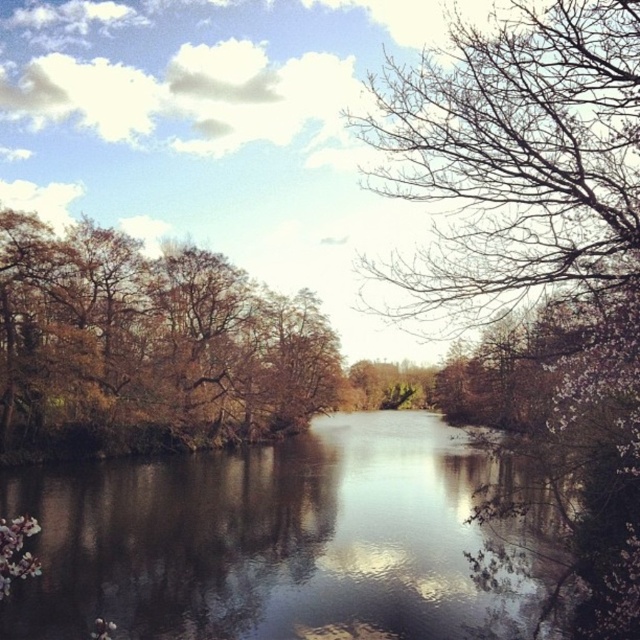
Is bare branches at upper right positioned behind brown leafy trees at left?

No, it is in front of brown leafy trees at left.

Is point (394, 136) more distant than point (170, 296)?

No, (394, 136) is closer to viewer.

Who is more forward, (528,152) or (116,358)?

Point (528,152)

Where is `bare branches at upper right`? This screenshot has width=640, height=640. bare branches at upper right is located at coordinates (538, 228).

Does point (163, 589) lie behind point (321, 388)?

That is False.

Can you confirm if brown reflective water at center is wider than brown leafy trees at left?

Yes, brown reflective water at center is wider than brown leafy trees at left.

Is point (410, 467) more distant than point (108, 355)?

No.

Find the location of a particular element. brown reflective water at center is located at coordinates (269, 540).

Is brown reflective water at center positioned behind bare branches at upper right?

Yes, it is.

Who is more distant from viewer, (301, 454) or (560, 220)?

The point (301, 454) is behind.

Does point (280, 552) lie behind point (625, 392)?

Yes, it is behind point (625, 392).

Find the location of a particular element. This screenshot has height=640, width=640. brown reflective water at center is located at coordinates (269, 540).